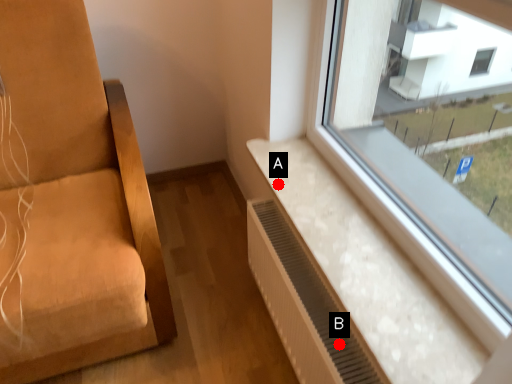
Question: Two points are circled on the image, labeled by A and B beside each circle. Among these points, which one is farthest from the camera?

Choices:
 (A) A is further
 (B) B is further

Answer: (A)